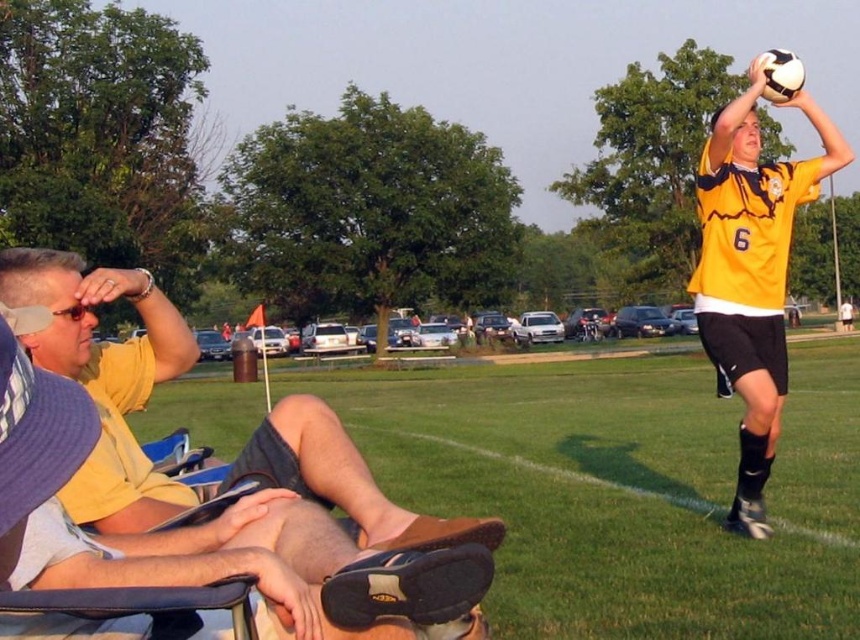
You are a photographer trying to capture a clear shot of the soccer player in the midground. However, your view is partially blocked by the dark blue fabric folding chair at lower left and the matte yellow sunglasses at upper left. Which object is closer to the ground and might be easier to crouch under to get a better angle?

The dark blue fabric folding chair at lower left has a lesser height compared to matte yellow sunglasses at upper left, so it is closer to the ground and easier to crouch under to get a better angle.

You are a photographer trying to capture a closeup of the yellow cotton shirt at left and the matte yellow sunglasses at upper left. Which object should you zoom in on to ensure both are in focus without moving the camera?

The yellow cotton shirt at left is larger than the matte yellow sunglasses at upper left, so you should zoom in on the yellow cotton shirt at left to ensure both are in focus without moving the camera.

You are a soccer player standing on the field and want to kick the ball to the point marked as point (37, 454). Which direction should you kick the ball to reach the point?

The point (37, 454) is located on the dark blue fabric folding chair at lower left, so you should kick the ball towards the lower left direction to reach it.